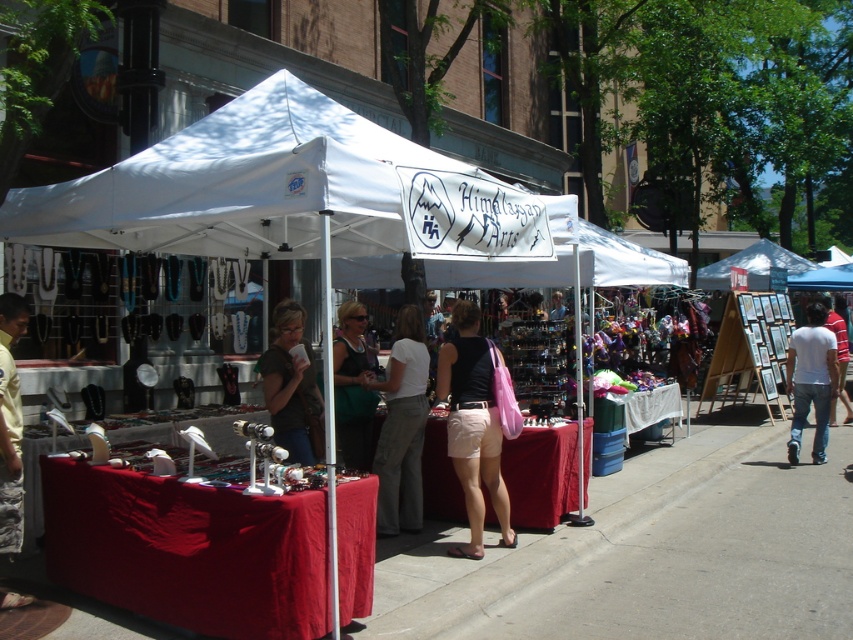
You are standing at the entrance of the market, and you want to locate the white fabric canopy at center. According to the coordinates provided, where would you find it?

The white fabric canopy at center is located at the coordinates point (262, 188).

Consider the image. You are standing at the entrance of the Himalayan Arts tent and want to reach the point marked as point (793, 408). However, there is an obstacle at point (305, 380). Which direction should you move to avoid the obstacle and reach your destination?

Since point (305, 380) is in front of point (793, 408), you should move around the obstacle by going either to the left or right to reach your destination.